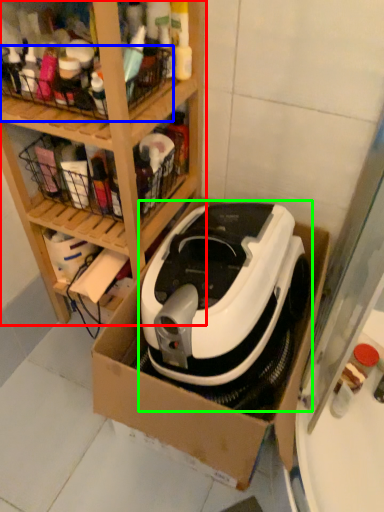
Question: Which object is the closest to the shelf (highlighted by a red box)? Choose among these: basket (highlighted by a blue box) or home appliance (highlighted by a green box).

Choices:
 (A) basket
 (B) home appliance

Answer: (A)